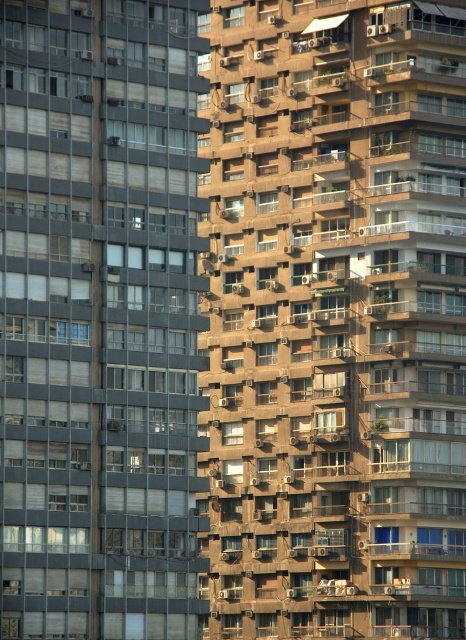
You are standing on the rooftop of the brown concrete building at center and want to look down at the matte glass windows at left. Can you see them from your current position?

The brown concrete building at center is above matte glass windows at left, so yes, you can see them from the rooftop.

You are a city planner evaluating the two buildings in the image. The brown concrete building at center and the matte glass windows at left. Which building has a greater overall footprint in terms of area?

The brown concrete building at center is larger in size than the matte glass windows at left, so it has a greater overall footprint in terms of area.